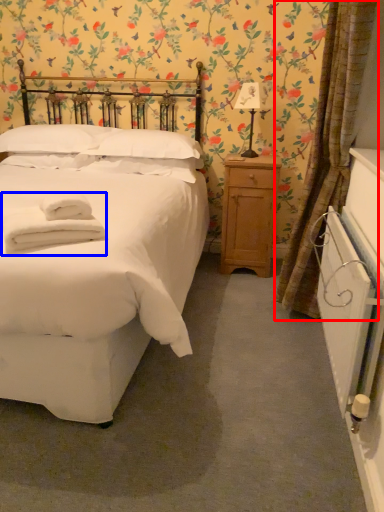
Question: Among these objects, which one is nearest to the camera, curtain (highlighted by a red box) or bath towel (highlighted by a blue box)?

Choices:
 (A) curtain
 (B) bath towel

Answer: (B)